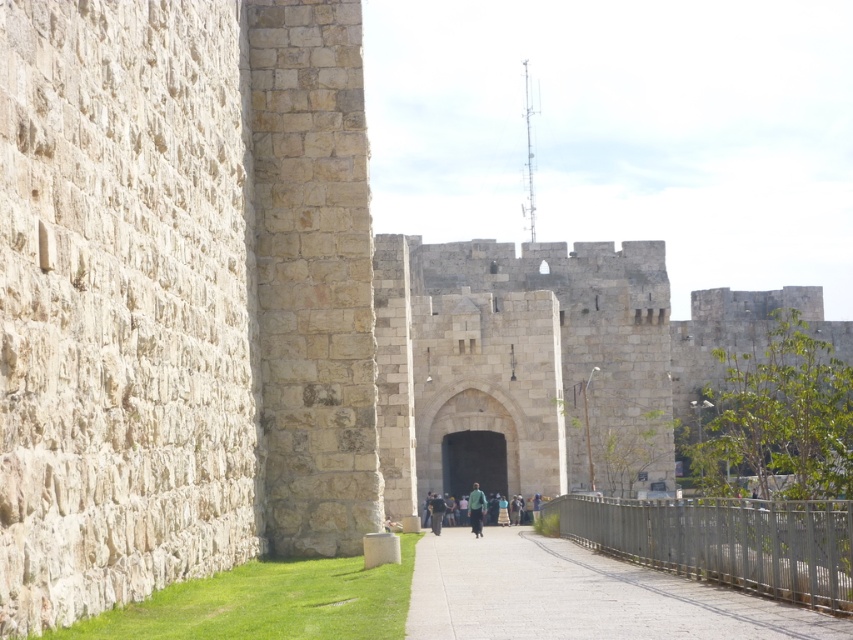
Question: Can you confirm if stone castle at center is positioned to the right of smooth concrete path at center?

Choices:
 (A) no
 (B) yes

Answer: (B)

Question: From the image, what is the correct spatial relationship of stone castle at center in relation to green fabric person at center?

Choices:
 (A) above
 (B) below

Answer: (A)

Question: Which point is closer to the camera?

Choices:
 (A) smooth concrete path at center
 (B) green fabric person at center

Answer: (A)

Question: Which of these objects is positioned closest to the green fabric person at center?

Choices:
 (A) stone castle at center
 (B) smooth concrete path at center

Answer: (B)

Question: Can you confirm if green fabric person at center is positioned to the left of green fabric at center?

Choices:
 (A) no
 (B) yes

Answer: (A)

Question: Which of these objects is positioned farthest from the smooth concrete path at center?

Choices:
 (A) green fabric person at center
 (B) black stone archway at center

Answer: (B)